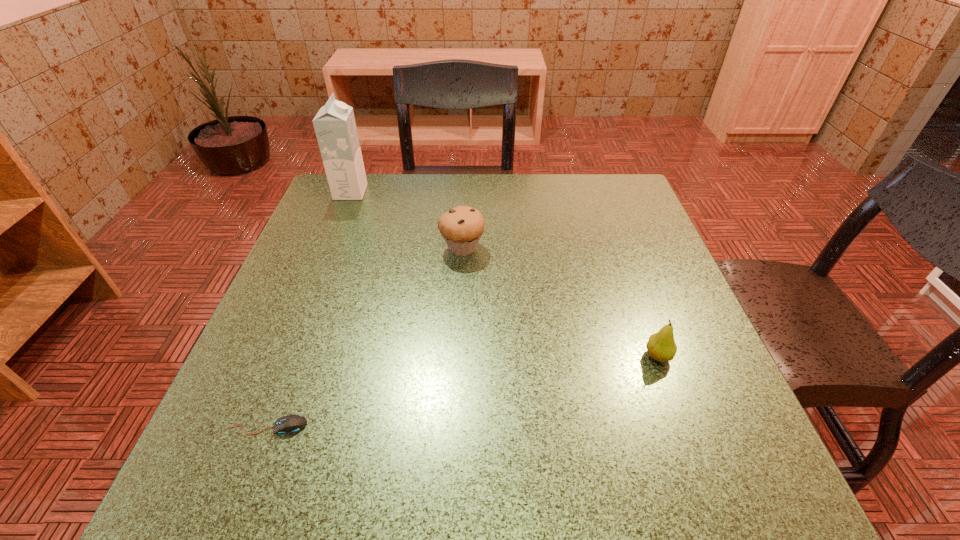
In the image, there is a desktop. Where is `vacant space at the right edge`? vacant space at the right edge is located at coordinates (666, 295).

In the image, there is a desktop. Identify the location of free space at the far left corner. (370, 225).

Where is `vacant space at the near left corner of the desktop`? Image resolution: width=960 pixels, height=540 pixels. vacant space at the near left corner of the desktop is located at coordinates (265, 488).

This screenshot has height=540, width=960. Find the location of `free spot at the far right corner of the desktop`. free spot at the far right corner of the desktop is located at coordinates (626, 197).

Image resolution: width=960 pixels, height=540 pixels. I want to click on free space at the near right corner of the desktop, so click(718, 483).

The height and width of the screenshot is (540, 960). I want to click on vacant region between the tallest object and the shortest object, so click(310, 309).

Identify the location of empty space that is in between the farthest object and the second object from right to left. (406, 220).

This screenshot has width=960, height=540. I want to click on vacant area between the carton and the second farthest object, so click(x=406, y=220).

The height and width of the screenshot is (540, 960). I want to click on unoccupied area between the carton and the shortest object, so click(x=310, y=309).

Identify the location of free space between the farthest object and the second farthest object. (406, 220).